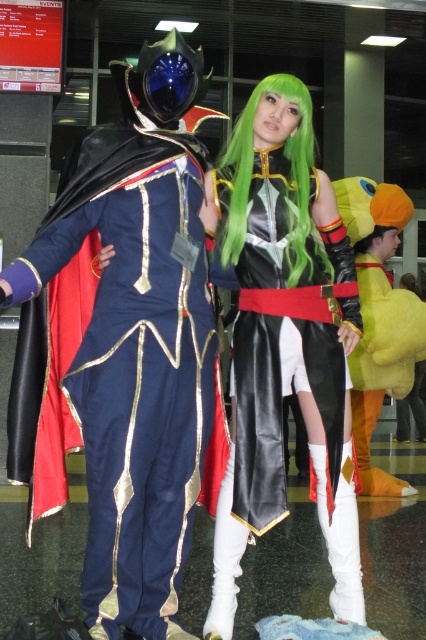
Question: Which point is farther to the camera?

Choices:
 (A) green matte wig at center
 (B) shiny blue fabric cape at left

Answer: (A)

Question: Can you confirm if shiny blue fabric cape at left is wider than black leather dress at center?

Choices:
 (A) yes
 (B) no

Answer: (A)

Question: Can you confirm if shiny blue fabric cape at left is thinner than black leather dress at center?

Choices:
 (A) yes
 (B) no

Answer: (B)

Question: Considering the real-world distances, which object is farthest from the black leather dress at center?

Choices:
 (A) shiny blue fabric cape at left
 (B) green matte wig at center

Answer: (B)

Question: Based on their relative distances, which object is nearer to the green matte wig at center?

Choices:
 (A) shiny blue fabric cape at left
 (B) black leather dress at center

Answer: (B)

Question: Is black leather dress at center in front of green matte wig at center?

Choices:
 (A) yes
 (B) no

Answer: (A)